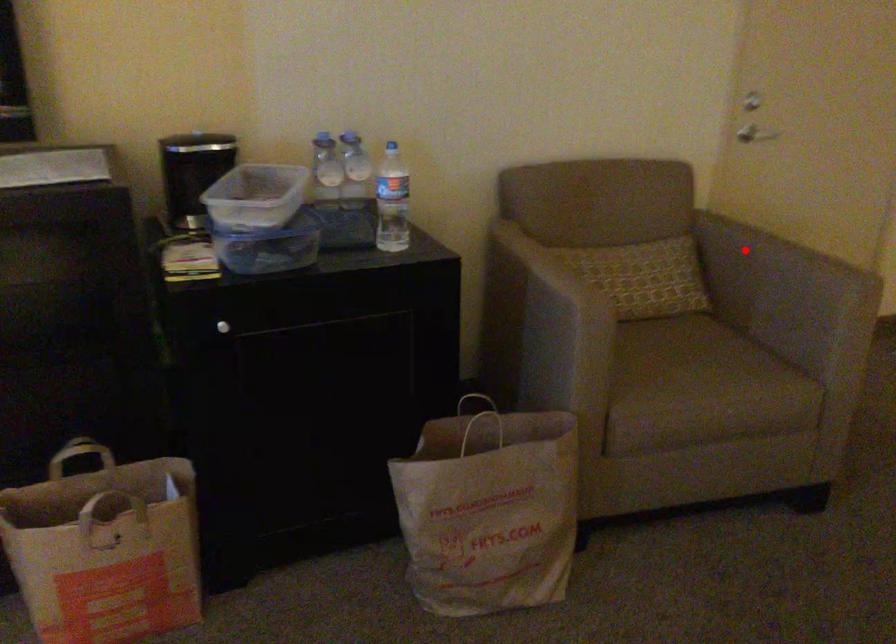
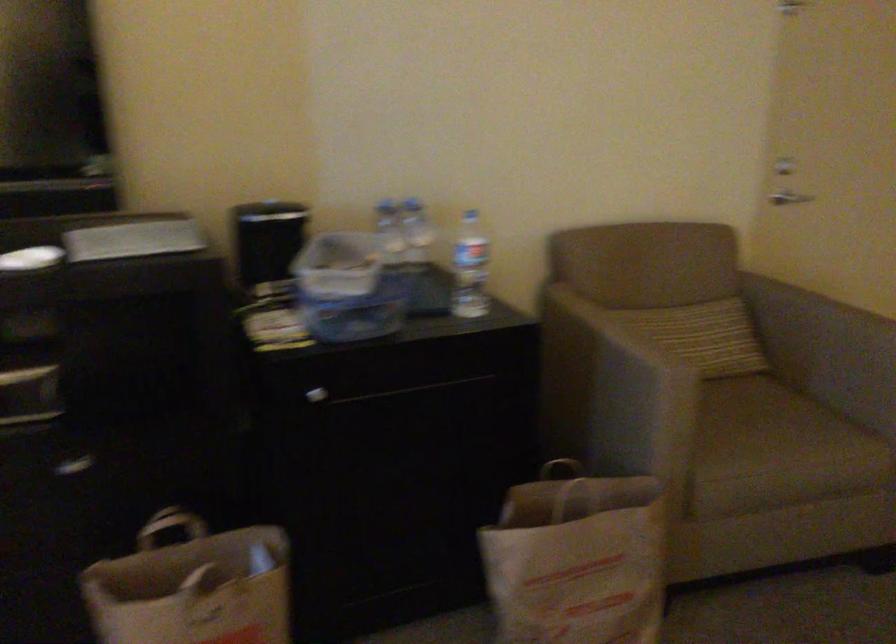
In the second image, find the point that corresponds to the highlighted location in the first image.

(807, 308)